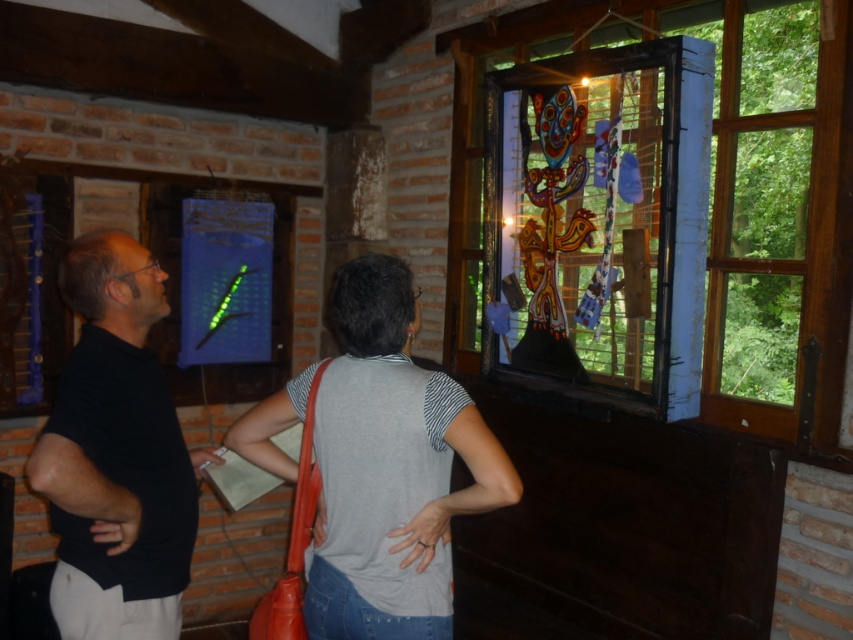
Question: Which point is closer to the camera?

Choices:
 (A) black matte shirt at left
 (B) stained glass window at upper right

Answer: (A)

Question: Which of the following is the farthest from the observer?

Choices:
 (A) (802, 240)
 (B) (412, 436)
 (C) (96, 321)

Answer: (A)

Question: Which object is farther from the camera taking this photo?

Choices:
 (A) gray cotton shirt at center
 (B) black matte shirt at left

Answer: (A)

Question: Is stained glass window at upper right to the left of black matte shirt at left from the viewer's perspective?

Choices:
 (A) no
 (B) yes

Answer: (A)

Question: Is stained glass window at upper right wider than black matte shirt at left?

Choices:
 (A) no
 (B) yes

Answer: (B)

Question: Is gray cotton shirt at center wider than black matte shirt at left?

Choices:
 (A) yes
 (B) no

Answer: (A)